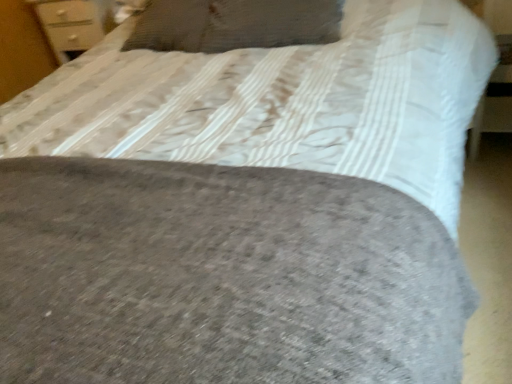
Question: Considering their positions, is matte white dresser at upper left located in front of or behind woolen pillow at upper center?

Choices:
 (A) behind
 (B) front

Answer: (A)

Question: Based on their sizes in the image, would you say matte white dresser at upper left is bigger or smaller than woolen pillow at upper center?

Choices:
 (A) big
 (B) small

Answer: (A)

Question: Choose the correct answer: Is matte white dresser at upper left inside woolen pillow at upper center or outside it?

Choices:
 (A) inside
 (B) outside

Answer: (B)

Question: Considering their positions, is woolen pillow at upper center located in front of or behind matte white dresser at upper left?

Choices:
 (A) behind
 (B) front

Answer: (B)

Question: Is woolen pillow at upper center inside or outside of matte white dresser at upper left?

Choices:
 (A) inside
 (B) outside

Answer: (B)

Question: Based on their sizes in the image, would you say woolen pillow at upper center is bigger or smaller than matte white dresser at upper left?

Choices:
 (A) big
 (B) small

Answer: (B)

Question: In terms of width, does woolen pillow at upper center look wider or thinner when compared to matte white dresser at upper left?

Choices:
 (A) thin
 (B) wide

Answer: (B)